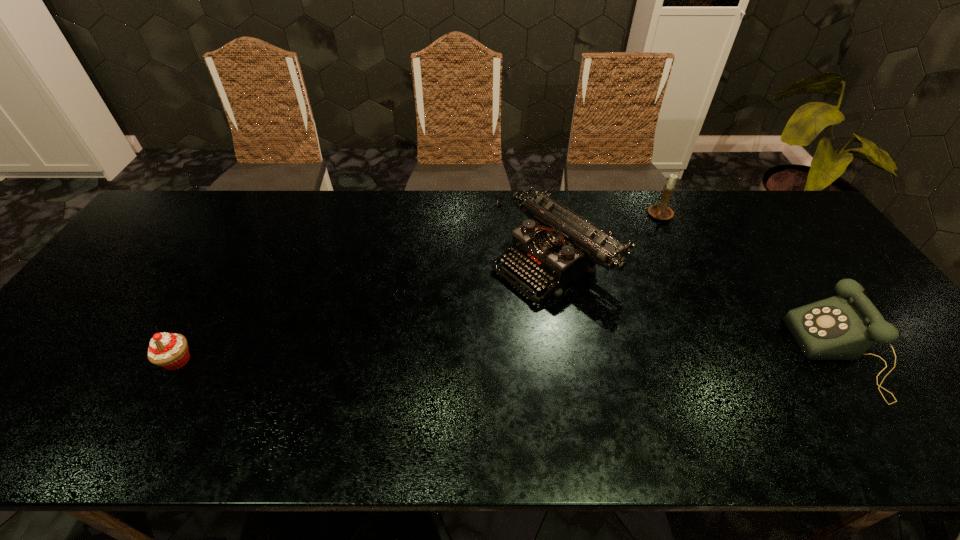
I want to click on free space located on the side of the candle holder with the handle, so click(x=644, y=238).

Identify the location of vacant space located on the side of the candle holder with the handle. The height and width of the screenshot is (540, 960). (598, 298).

Find the location of a particular element. The height and width of the screenshot is (540, 960). vacant area located on the side of the candle holder with the handle is located at coordinates (617, 273).

Identify the location of free point located on the keyboard of the typewriter. Image resolution: width=960 pixels, height=540 pixels. (476, 313).

Identify the location of free point located 0.280m on the keyboard of the typewriter. (427, 346).

Where is `blank area located on the keyboard of the typewriter`? blank area located on the keyboard of the typewriter is located at coordinates [455, 327].

The image size is (960, 540). In order to click on candle holder that is at the far edge in this screenshot , I will do `click(661, 211)`.

At what (x,y) coordinates should I click in order to perform the action: click on typewriter present at the far edge. Please return your answer as a coordinate pair (x, y). This screenshot has width=960, height=540. Looking at the image, I should click on (556, 246).

Locate an element on the screen. This screenshot has height=540, width=960. cupcake that is at the near edge is located at coordinates (168, 350).

You are a GUI agent. You are given a task and a screenshot of the screen. Output one action in this format:
    pyautogui.click(x=<x>, y=<y>)
    Task: Click on the telephone that is at the near edge
    
    Given the screenshot: What is the action you would take?
    pyautogui.click(x=843, y=327)